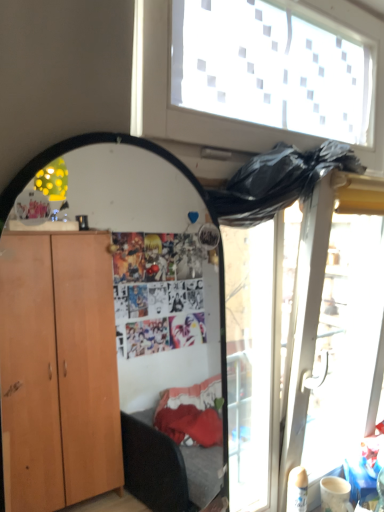
This screenshot has height=512, width=384. Describe the element at coordinates (107, 322) in the screenshot. I see `wooden mirror at left` at that location.

Measure the distance between point (12, 298) and camera.

Point (12, 298) is 27.36 inches from camera.

At what (x,y) coordinates should I click in order to perform the action: click on wooden mirror at left. Please return your answer as a coordinate pair (x, y). This screenshot has width=384, height=512. Looking at the image, I should click on (107, 322).

Locate an element on the screen. wooden mirror at left is located at coordinates (107, 322).